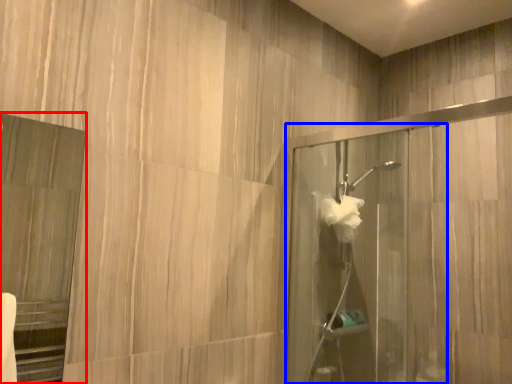
Question: Which object appears farthest to the camera in this image, screen door (highlighted by a red box) or screen door (highlighted by a blue box)?

Choices:
 (A) screen door
 (B) screen door

Answer: (B)